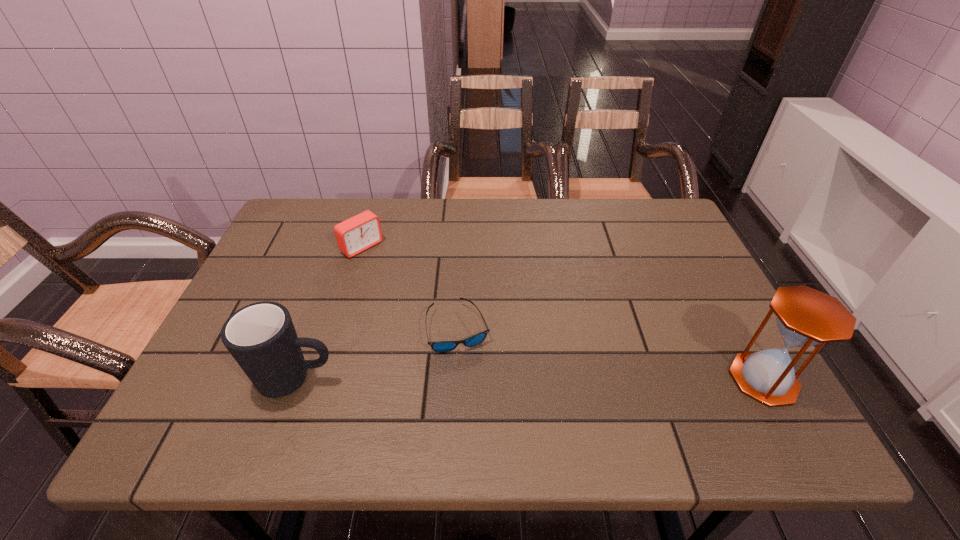
At what (x,y) coordinates should I click in order to perform the action: click on free point located 0.060m at the front of the sunglasses showing the lenses. Please return your answer as a coordinate pair (x, y). Looking at the image, I should click on (503, 359).

Image resolution: width=960 pixels, height=540 pixels. In order to click on free location located 0.050m at the front of the sunglasses showing the lenses in this screenshot , I will do `click(499, 356)`.

Locate an element on the screen. This screenshot has height=540, width=960. vacant position located on the front-facing side of the third tallest object is located at coordinates (443, 312).

Image resolution: width=960 pixels, height=540 pixels. What are the coordinates of `vacant area situated 0.060m on the front-facing side of the third tallest object` in the screenshot? It's located at (386, 267).

Where is `free space located 0.130m on the front-facing side of the third tallest object`? Image resolution: width=960 pixels, height=540 pixels. free space located 0.130m on the front-facing side of the third tallest object is located at coordinates (402, 279).

Locate an element on the screen. object that is positioned at the far edge is located at coordinates (358, 233).

Find the location of a particular element. This screenshot has height=540, width=960. mug that is at the near edge is located at coordinates (261, 337).

The image size is (960, 540). What are the coordinates of `hourglass at the near edge` in the screenshot? It's located at (806, 317).

Identify the location of object that is at the left edge. The height and width of the screenshot is (540, 960). (261, 337).

Where is `object present at the right edge`? Image resolution: width=960 pixels, height=540 pixels. object present at the right edge is located at coordinates (806, 317).